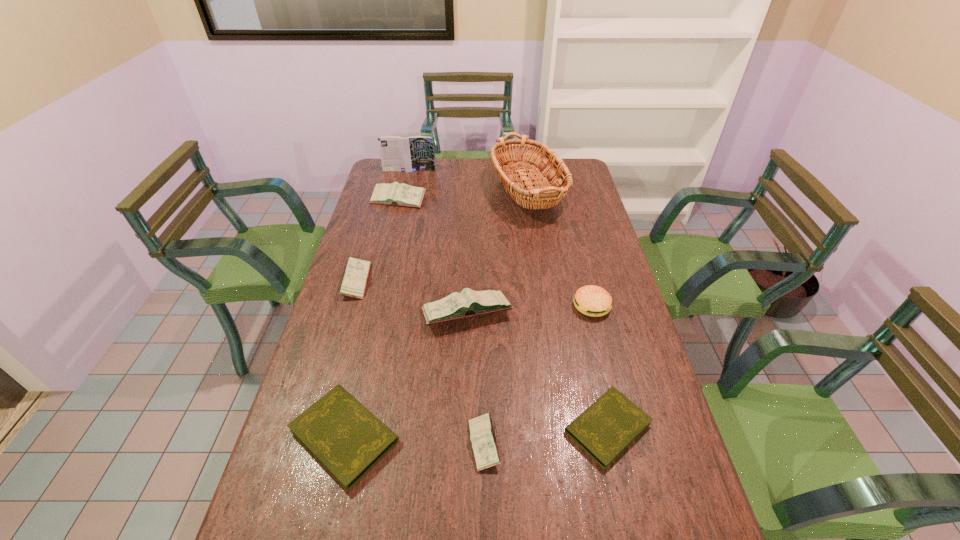
Where is `object present at the far right corner`? The width and height of the screenshot is (960, 540). object present at the far right corner is located at coordinates (538, 194).

Find the location of a particular element. This screenshot has height=540, width=960. free space at the left edge of the desktop is located at coordinates (311, 382).

Locate an element on the screen. Image resolution: width=960 pixels, height=540 pixels. free space at the right edge is located at coordinates (645, 363).

Identify the location of vacant space at the far left corner of the desktop. The image size is (960, 540). (397, 179).

Where is `free spot between the shortest diary and the seventh shortest object`? This screenshot has height=540, width=960. free spot between the shortest diary and the seventh shortest object is located at coordinates (538, 370).

The image size is (960, 540). I want to click on blank region between the brown patty and the nearest pink diary, so click(x=538, y=375).

Locate an element on the screen. empty space between the second tallest object and the tallest object is located at coordinates (468, 183).

The height and width of the screenshot is (540, 960). I want to click on vacant space that is in between the shortest object and the tallest diary, so click(x=538, y=370).

At what (x,y) coordinates should I click in order to perform the action: click on vacant region between the second smallest pink diary and the smaller green diary. Please return your answer as a coordinate pair (x, y). This screenshot has height=540, width=960. Looking at the image, I should click on pyautogui.click(x=482, y=354).

Where is `unoccupied position between the patty and the smallest pink diary`? This screenshot has width=960, height=540. unoccupied position between the patty and the smallest pink diary is located at coordinates (538, 375).